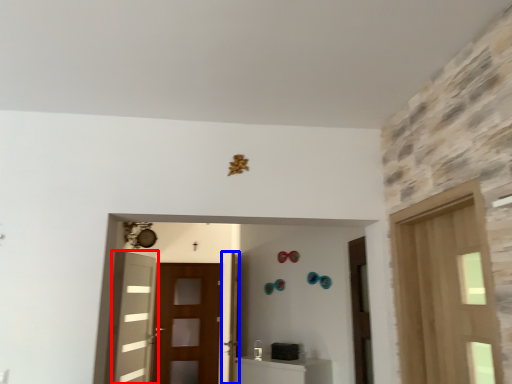
Question: Among these objects, which one is nearest to the camera, door (highlighted by a red box) or door (highlighted by a blue box)?

Choices:
 (A) door
 (B) door

Answer: (B)